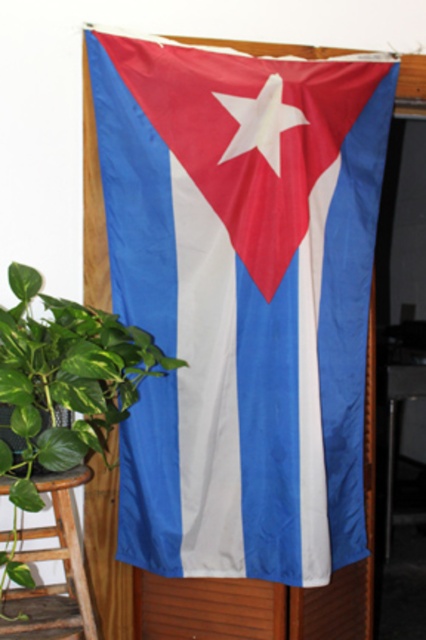
Between textured fabric flag at center and white matte star at center, which one appears on the left side from the viewer's perspective?

textured fabric flag at center is more to the left.

Is textured fabric flag at center behind white matte star at center?

No, it is not.

Is point (242, 465) closer to viewer compared to point (296, 113)?

No.

Find the location of `textured fabric flag at center`. textured fabric flag at center is located at coordinates (241, 300).

In the scene shown: Is white matte star at center thinner than wooden stool at lower left?

No, white matte star at center is not thinner than wooden stool at lower left.

Does white matte star at center appear on the right side of wooden stool at lower left?

In fact, white matte star at center is to the left of wooden stool at lower left.

Does point (273, 161) come farther from viewer compared to point (420, 368)?

No, it is not.

Find the location of a particular element. The height and width of the screenshot is (640, 426). white matte star at center is located at coordinates [261, 122].

Locate an element on the screen. This screenshot has width=426, height=640. wooden at left is located at coordinates (65, 572).

What do you see at coordinates (65, 572) in the screenshot? The width and height of the screenshot is (426, 640). I see `wooden at left` at bounding box center [65, 572].

Is point (75, 580) positioned after point (264, 109)?

No, (75, 580) is closer to viewer.

You are a GUI agent. You are given a task and a screenshot of the screen. Output one action in this format:
    pyautogui.click(x=<x>, y=<y>)
    Task: Click on the wooden at left
    
    Given the screenshot: What is the action you would take?
    pyautogui.click(x=65, y=572)